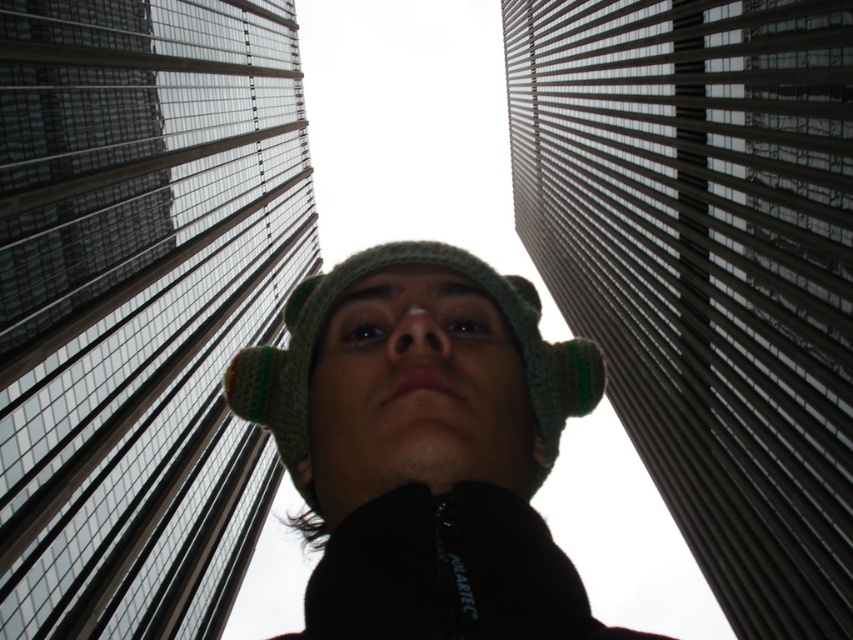
Which is behind, point (740, 284) or point (314, 534)?

The point (740, 284) is more distant.

Is point (785, 429) positioned before point (440, 545)?

No, it is behind (440, 545).

In order to click on glassy reflective skyscraper at center in this screenshot , I will do `click(706, 266)`.

Can you confirm if glassy steel skyscraper at center is bigger than glassy reflective skyscraper at center?

No, glassy steel skyscraper at center is not bigger than glassy reflective skyscraper at center.

Does glassy steel skyscraper at center appear on the right side of glassy reflective skyscraper at center?

No, glassy steel skyscraper at center is not to the right of glassy reflective skyscraper at center.

Locate an element on the screen. The width and height of the screenshot is (853, 640). glassy steel skyscraper at center is located at coordinates (138, 301).

Is glassy steel skyscraper at center closer to camera compared to green knitted hat at center?

No, it is behind green knitted hat at center.

Is glassy steel skyscraper at center below green knitted hat at center?

No.

Locate an element on the screen. glassy steel skyscraper at center is located at coordinates (138, 301).

Image resolution: width=853 pixels, height=640 pixels. I want to click on glassy steel skyscraper at center, so point(138,301).